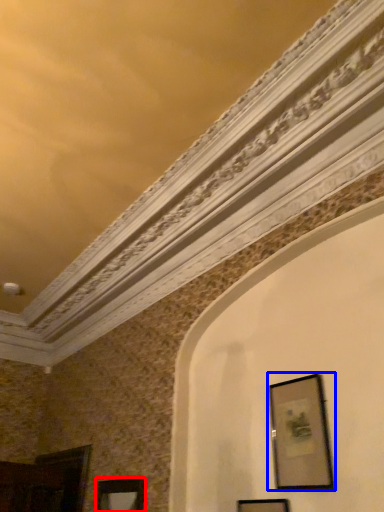
Question: Which of the following is the farthest to the observer, picture frame (highlighted by a red box) or picture frame (highlighted by a blue box)?

Choices:
 (A) picture frame
 (B) picture frame

Answer: (A)